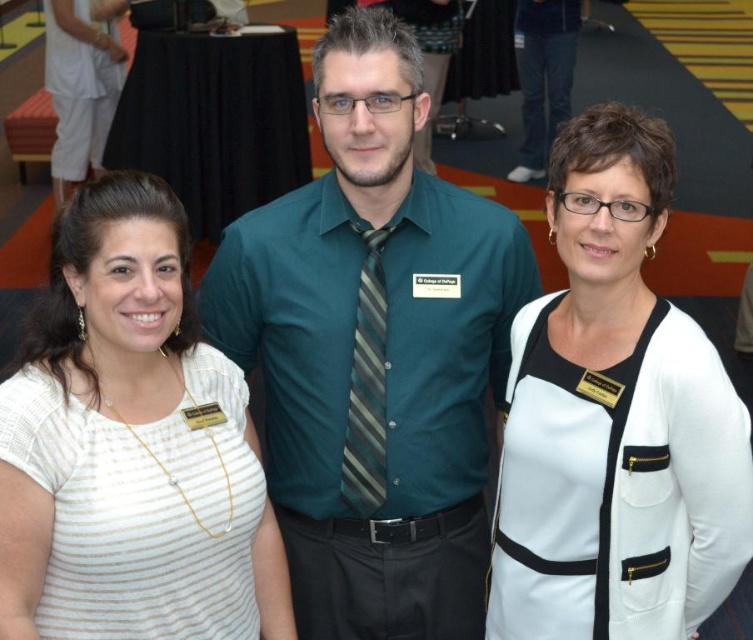
Is teal shirt at center positioned at the back of white matte cardigan at center?

Yes, it is behind white matte cardigan at center.

Who is positioned more to the left, teal shirt at center or white matte cardigan at center?

Positioned to the left is teal shirt at center.

Which is in front, point (488, 353) or point (529, 440)?

Point (529, 440) is in front.

At what (x,y) coordinates should I click in order to perform the action: click on teal shirt at center. Please return your answer as a coordinate pair (x, y). The height and width of the screenshot is (640, 753). Looking at the image, I should click on (373, 353).

Is the position of white matte cardigan at center less distant than that of white striped shirt at left?

No, white matte cardigan at center is further to the viewer.

Is white matte cardigan at center wider than white striped shirt at left?

In fact, white matte cardigan at center might be narrower than white striped shirt at left.

Is point (703, 506) more distant than point (169, 394)?

No, it is in front of (169, 394).

I want to click on white matte cardigan at center, so click(614, 419).

Can you confirm if teal shirt at center is positioned to the left of white striped shirt at left?

In fact, teal shirt at center is to the right of white striped shirt at left.

Between teal shirt at center and white striped shirt at left, which one appears on the left side from the viewer's perspective?

From the viewer's perspective, white striped shirt at left appears more on the left side.

Describe the element at coordinates (373, 353) in the screenshot. I see `teal shirt at center` at that location.

Image resolution: width=753 pixels, height=640 pixels. Identify the location of teal shirt at center. (373, 353).